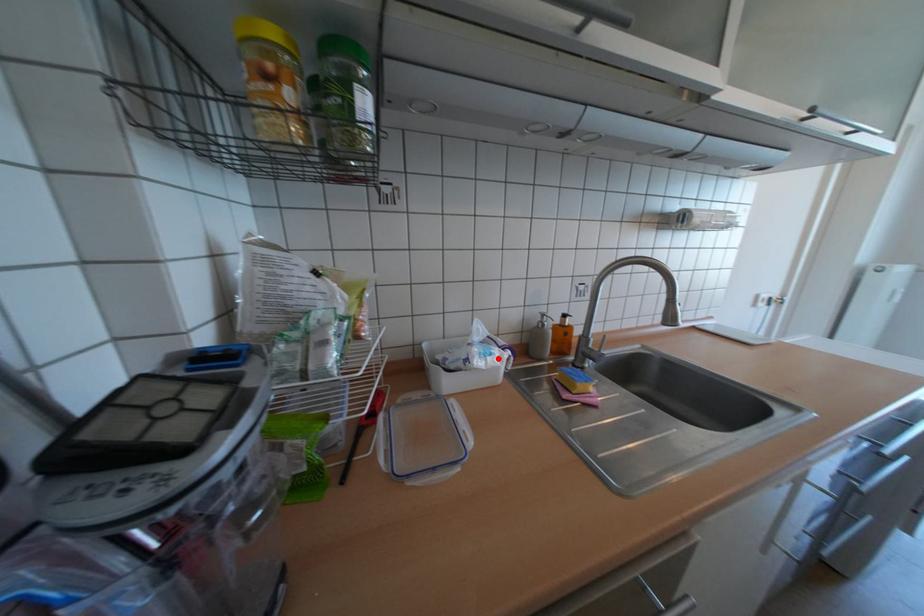
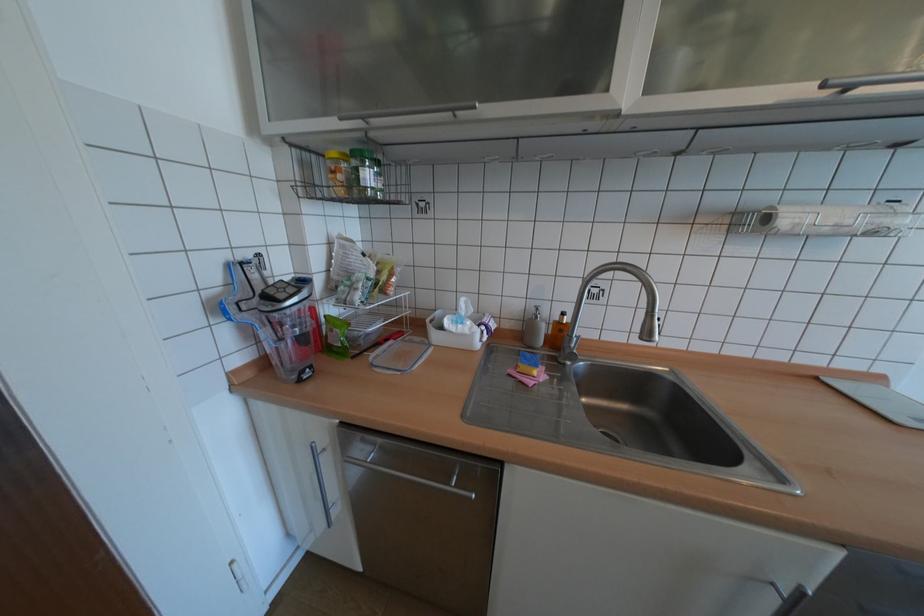
Locate, in the second image, the point that corresponds to the highlighted location in the first image.

(468, 326)